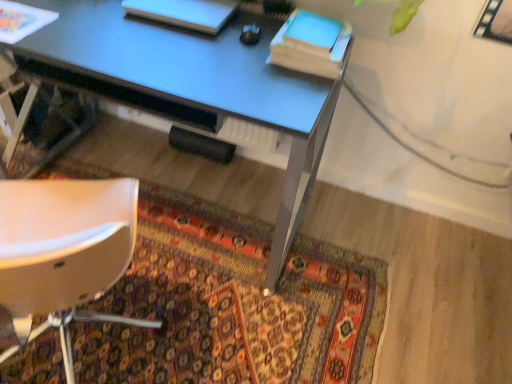
The width and height of the screenshot is (512, 384). What are the coordinates of `free location in front of white matte book at upper center, the first book in the left-to-right sequence` in the screenshot? It's located at (156, 54).